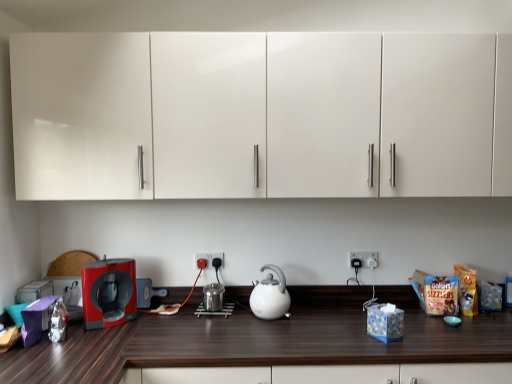
Question: Does white plastic electric outlet at center, marked as the 1th electric outlet in a right-to-left arrangement, have a greater height compared to black plastic electric outlet at center, the first electric outlet viewed from the left?

Choices:
 (A) no
 (B) yes

Answer: (B)

Question: Is white plastic electric outlet at center, acting as the second electric outlet starting from the left, outside of black plastic electric outlet at center, the first electric outlet viewed from the left?

Choices:
 (A) no
 (B) yes

Answer: (B)

Question: Does white plastic electric outlet at center, marked as the 1th electric outlet in a right-to-left arrangement, lie in front of black plastic electric outlet at center, the first electric outlet viewed from the left?

Choices:
 (A) no
 (B) yes

Answer: (A)

Question: From a real-world perspective, is white plastic electric outlet at center, marked as the 1th electric outlet in a right-to-left arrangement, beneath black plastic electric outlet at center, the first electric outlet viewed from the left?

Choices:
 (A) yes
 (B) no

Answer: (B)

Question: From a real-world perspective, is white plastic electric outlet at center, acting as the second electric outlet starting from the left, on black plastic electric outlet at center, marked as the second electric outlet in a right-to-left arrangement?

Choices:
 (A) no
 (B) yes

Answer: (B)

Question: Based on their positions, is black plastic electric outlet at center, marked as the second electric outlet in a right-to-left arrangement, located to the left or right of white glossy kettle at center?

Choices:
 (A) left
 (B) right

Answer: (A)

Question: In terms of height, does black plastic electric outlet at center, the first electric outlet viewed from the left, look taller or shorter compared to white glossy kettle at center?

Choices:
 (A) short
 (B) tall

Answer: (A)

Question: Considering the positions of black plastic electric outlet at center, the first electric outlet viewed from the left, and white glossy kettle at center in the image, is black plastic electric outlet at center, the first electric outlet viewed from the left, wider or thinner than white glossy kettle at center?

Choices:
 (A) thin
 (B) wide

Answer: (A)

Question: Does point [210, 263] appear closer or farther from the camera than point [267, 274]?

Choices:
 (A) farther
 (B) closer

Answer: (A)

Question: Is white glossy kettle at center taller or shorter than red glossy coffee machine at left?

Choices:
 (A) tall
 (B) short

Answer: (B)

Question: Considering the positions of white glossy kettle at center and red glossy coffee machine at left in the image, is white glossy kettle at center wider or thinner than red glossy coffee machine at left?

Choices:
 (A) thin
 (B) wide

Answer: (B)

Question: Based on their positions, is white glossy kettle at center located to the left or right of red glossy coffee machine at left?

Choices:
 (A) left
 (B) right

Answer: (B)

Question: Is white glossy kettle at center bigger or smaller than red glossy coffee machine at left?

Choices:
 (A) big
 (B) small

Answer: (A)

Question: In terms of size, does red glossy coffee machine at left appear bigger or smaller than dark wood countertop at lower center?

Choices:
 (A) big
 (B) small

Answer: (B)

Question: Considering the positions of point (123, 274) and point (16, 369), is point (123, 274) closer or farther from the camera than point (16, 369)?

Choices:
 (A) farther
 (B) closer

Answer: (A)